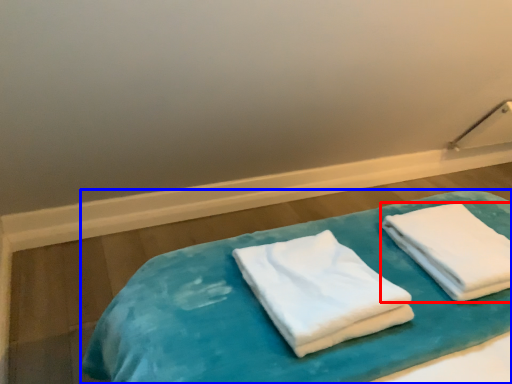
Question: Which of the following is the closest to the observer, towel (highlighted by a red box) or bed (highlighted by a blue box)?

Choices:
 (A) towel
 (B) bed

Answer: (A)